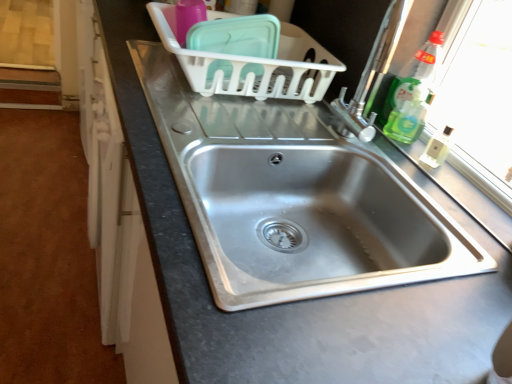
Question: Considering the relative sizes of stainless steel sink at center, which is the 1th sink from bottom to top, and clear plastic bottle at upper right, positioned as the 1th bottle in top-to-bottom order, in the image provided, is stainless steel sink at center, which is the 1th sink from bottom to top, shorter than clear plastic bottle at upper right, positioned as the 1th bottle in top-to-bottom order,?

Choices:
 (A) yes
 (B) no

Answer: (B)

Question: Considering the relative positions of stainless steel sink at center, which is the 1th sink from bottom to top, and clear plastic bottle at upper right, the 2th bottle from the bottom, in the image provided, is stainless steel sink at center, which is the 1th sink from bottom to top, to the right of clear plastic bottle at upper right, the 2th bottle from the bottom, from the viewer's perspective?

Choices:
 (A) yes
 (B) no

Answer: (B)

Question: Does stainless steel sink at center, which is the 2th sink from top to bottom, lie behind clear plastic bottle at upper right, positioned as the 1th bottle in top-to-bottom order?

Choices:
 (A) no
 (B) yes

Answer: (A)

Question: Is stainless steel sink at center, which is the 1th sink from bottom to top, looking in the opposite direction of clear plastic bottle at upper right, the 2th bottle from the bottom?

Choices:
 (A) no
 (B) yes

Answer: (A)

Question: From a real-world perspective, does stainless steel sink at center, which is the 1th sink from bottom to top, stand above clear plastic bottle at upper right, the 2th bottle from the bottom?

Choices:
 (A) no
 (B) yes

Answer: (A)

Question: Does stainless steel sink at center, which is the 1th sink from bottom to top, appear on the left side of clear plastic bottle at upper right, the 2th bottle from the bottom?

Choices:
 (A) no
 (B) yes

Answer: (B)

Question: Is clear plastic bottle at upper right, positioned as the 1th bottle in top-to-bottom order, positioned before green translucent liquid at right, the first bottle from the bottom?

Choices:
 (A) no
 (B) yes

Answer: (B)

Question: Does clear plastic bottle at upper right, the 2th bottle from the bottom, touch green translucent liquid at right, the second bottle from the top?

Choices:
 (A) no
 (B) yes

Answer: (B)

Question: Is green translucent liquid at right, the second bottle from the top, inside clear plastic bottle at upper right, positioned as the 1th bottle in top-to-bottom order?

Choices:
 (A) no
 (B) yes

Answer: (A)

Question: From the image's perspective, is clear plastic bottle at upper right, positioned as the 1th bottle in top-to-bottom order, on green translucent liquid at right, the second bottle from the top?

Choices:
 (A) yes
 (B) no

Answer: (A)

Question: Is clear plastic bottle at upper right, the 2th bottle from the bottom, located outside green translucent liquid at right, the first bottle from the bottom?

Choices:
 (A) no
 (B) yes

Answer: (B)

Question: Considering the relative positions of clear plastic bottle at upper right, the 2th bottle from the bottom, and green translucent liquid at right, the second bottle from the top, in the image provided, is clear plastic bottle at upper right, the 2th bottle from the bottom, to the right of green translucent liquid at right, the second bottle from the top, from the viewer's perspective?

Choices:
 (A) yes
 (B) no

Answer: (A)

Question: Does stainless steel sink at center, arranged as the first sink when viewed from the top, have a greater height compared to green translucent liquid at right, the second bottle from the top?

Choices:
 (A) no
 (B) yes

Answer: (B)